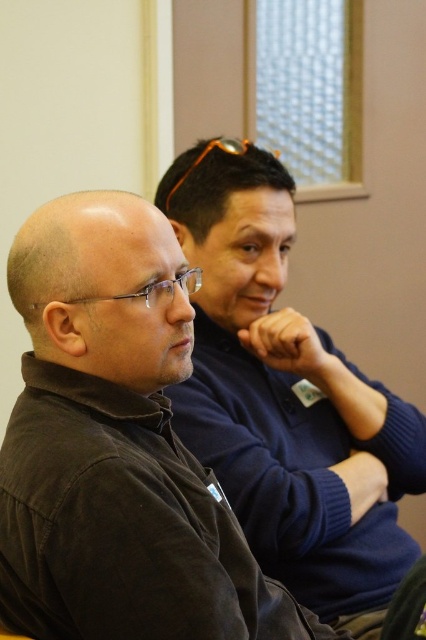
Question: Does black matte jacket at left appear on the right side of navy blue sweater at center?

Choices:
 (A) yes
 (B) no

Answer: (B)

Question: Can you confirm if black matte jacket at left is positioned to the left of navy blue sweater at center?

Choices:
 (A) yes
 (B) no

Answer: (A)

Question: In this image, where is black matte jacket at left located relative to navy blue sweater at center?

Choices:
 (A) above
 (B) below

Answer: (B)

Question: Which of the following is the farthest from the observer?

Choices:
 (A) (192, 280)
 (B) (273, 570)

Answer: (B)

Question: Among these objects, which one is farthest from the camera?

Choices:
 (A) navy blue sweater at center
 (B) black matte jacket at left

Answer: (A)